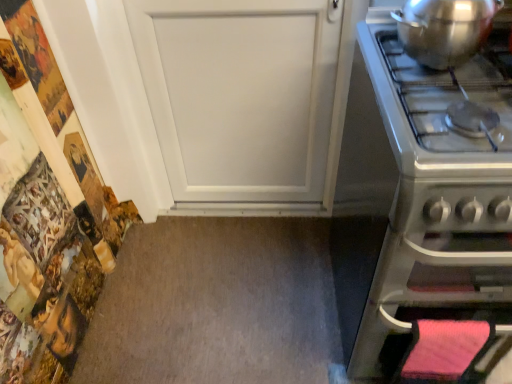
Question: Should I look upward or downward to see satin silver oven at right?

Choices:
 (A) down
 (B) up

Answer: (A)

Question: Could you tell me if satin silver oven at right is facing shiny metallic pot at upper right?

Choices:
 (A) yes
 (B) no

Answer: (B)

Question: Does satin silver oven at right have a lesser height compared to shiny metallic pot at upper right?

Choices:
 (A) yes
 (B) no

Answer: (B)

Question: From a real-world perspective, is satin silver oven at right positioned under shiny metallic pot at upper right based on gravity?

Choices:
 (A) no
 (B) yes

Answer: (B)

Question: Would you say satin silver oven at right is outside shiny metallic pot at upper right?

Choices:
 (A) no
 (B) yes

Answer: (B)

Question: Is satin silver oven at right facing away from shiny metallic pot at upper right?

Choices:
 (A) no
 (B) yes

Answer: (A)

Question: Is satin silver oven at right placed right next to shiny metallic pot at upper right?

Choices:
 (A) no
 (B) yes

Answer: (A)

Question: Considering the relative sizes of shiny metallic pot at upper right and satin silver oven at right in the image provided, is shiny metallic pot at upper right thinner than satin silver oven at right?

Choices:
 (A) no
 (B) yes

Answer: (B)

Question: Considering the relative positions of shiny metallic pot at upper right and satin silver oven at right in the image provided, is shiny metallic pot at upper right to the right of satin silver oven at right from the viewer's perspective?

Choices:
 (A) no
 (B) yes

Answer: (A)

Question: Is satin silver oven at right a part of shiny metallic pot at upper right?

Choices:
 (A) no
 (B) yes

Answer: (A)

Question: Can you confirm if shiny metallic pot at upper right is taller than satin silver oven at right?

Choices:
 (A) yes
 (B) no

Answer: (B)

Question: Can we say shiny metallic pot at upper right lies outside satin silver oven at right?

Choices:
 (A) yes
 (B) no

Answer: (A)

Question: From a real-world perspective, is shiny metallic pot at upper right located beneath satin silver oven at right?

Choices:
 (A) no
 (B) yes

Answer: (A)

Question: From a real-world perspective, is shiny metallic pot at upper right above or below satin silver oven at right?

Choices:
 (A) below
 (B) above

Answer: (B)